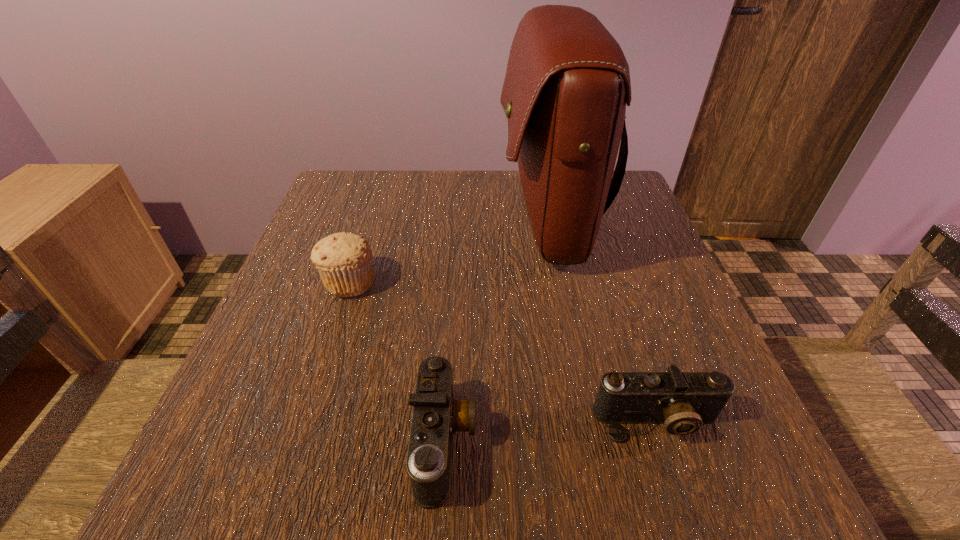
Find the location of a particular element. The height and width of the screenshot is (540, 960). vacant space that is in between the leftmost object and the satchel is located at coordinates (448, 252).

At what (x,y) coordinates should I click in order to perform the action: click on vacant area between the satchel and the left camera. Please return your answer as a coordinate pair (x, y). Looking at the image, I should click on coord(495,331).

This screenshot has height=540, width=960. In order to click on vacant space that's between the left camera and the leftmost object in this screenshot , I will do `click(397, 362)`.

Find the location of a particular element. The width and height of the screenshot is (960, 540). object that is the second nearest to the third shortest object is located at coordinates (567, 83).

The image size is (960, 540). I want to click on object that ranks as the closest to the right camera, so click(x=437, y=415).

Locate an element on the screen. The width and height of the screenshot is (960, 540). free location that satisfies the following two spatial constraints: 1. on the open flap of the satchel; 2. on the front side of the leftmost object is located at coordinates (559, 282).

The width and height of the screenshot is (960, 540). What are the coordinates of `vacant region that satisfies the following two spatial constraints: 1. on the front-facing side of the right camera; 2. on the lens of the left camera` in the screenshot? It's located at (663, 441).